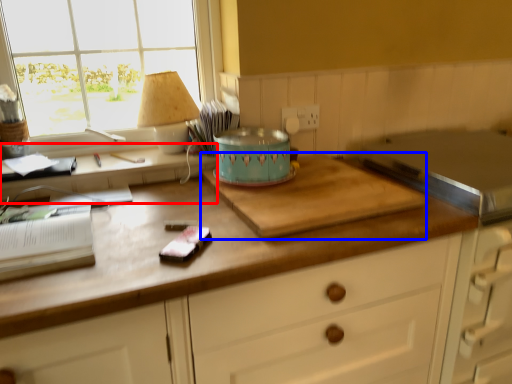
Question: Which object appears farthest to the camera in this image, computer desk (highlighted by a red box) or cutting board (highlighted by a blue box)?

Choices:
 (A) computer desk
 (B) cutting board

Answer: (A)